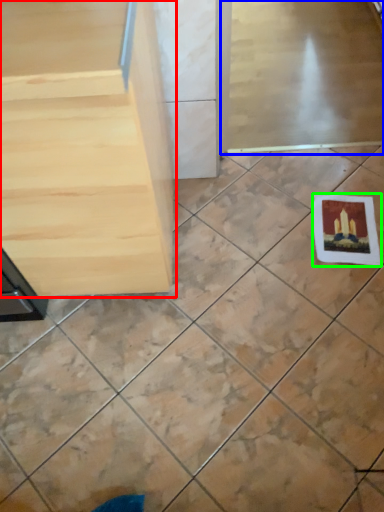
Question: Based on their relative distances, which object is farther from furniture (highlighted by a red box)? Choose from screen door (highlighted by a blue box) and postcard (highlighted by a green box).

Choices:
 (A) screen door
 (B) postcard

Answer: (A)